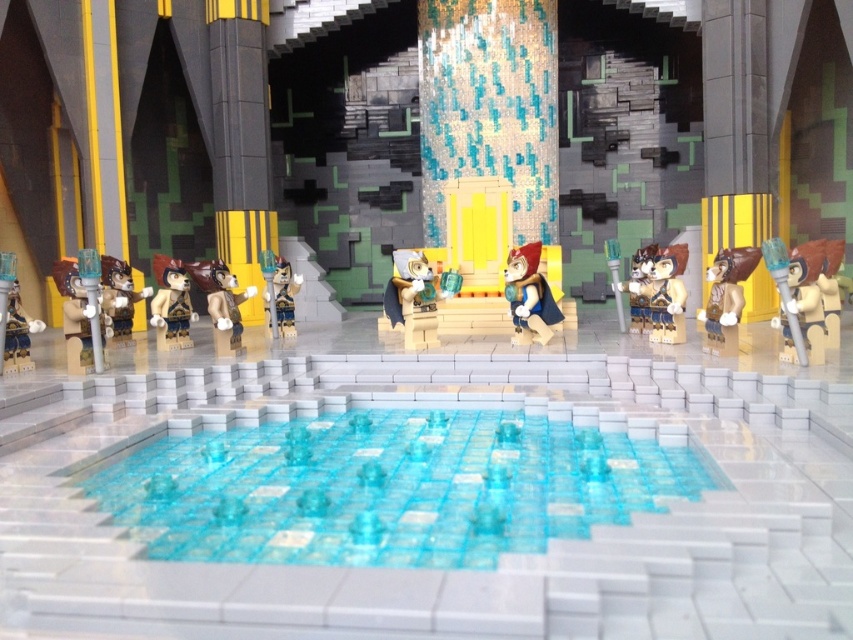
Who is positioned more to the left, brown matte figure at left or matte black minifigure at left?

matte black minifigure at left is more to the left.

Which of these two, brown matte figure at left or matte black minifigure at left, stands taller?

brown matte figure at left is taller.

Is point (173, 332) closer to viewer compared to point (6, 348)?

No.

Find the location of a particular element. brown matte figure at left is located at coordinates (171, 304).

Which of these two, brown matte figure at left or matte gray fur at center, stands shorter?

Standing shorter between the two is matte gray fur at center.

Is brown matte figure at left wider than matte gray fur at center?

Correct, the width of brown matte figure at left exceeds that of matte gray fur at center.

Which is in front, point (183, 285) or point (387, 320)?

Positioned in front is point (183, 285).

Identify the location of brown matte figure at left. The height and width of the screenshot is (640, 853). (171, 304).

Between point (64, 294) and point (215, 342), which one is positioned in front?

Positioned in front is point (64, 294).

Find the location of a particular element. The width and height of the screenshot is (853, 640). matte brown torch at left is located at coordinates (79, 317).